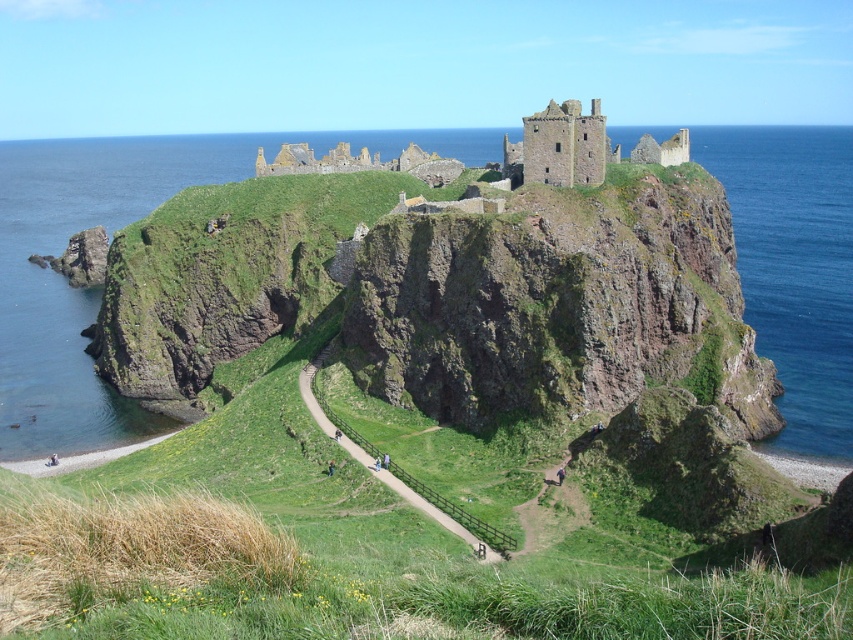
From the picture: Can you confirm if brown stone castle at upper center is taller than green grassy path at center?

Correct, brown stone castle at upper center is much taller as green grassy path at center.

Looking at this image, is brown stone castle at upper center closer to camera compared to green grassy path at center?

No, brown stone castle at upper center is behind green grassy path at center.

Locate an element on the screen. The height and width of the screenshot is (640, 853). brown stone castle at upper center is located at coordinates (561, 147).

Identify the location of brown stone castle at upper center. (561, 147).

Can you confirm if blue water at upper left is smaller than green grassy path at center?

Incorrect, blue water at upper left is not smaller in size than green grassy path at center.

Is point (61, 211) positioned behind point (363, 438)?

Yes.

Find the location of a particular element. blue water at upper left is located at coordinates (109, 236).

Measure the distance between point [135,141] and camera.

They are 508.88 meters apart.

Which is below, blue water at upper left or brown stone castle at upper center?

brown stone castle at upper center

Describe the element at coordinates (109, 236) in the screenshot. I see `blue water at upper left` at that location.

Image resolution: width=853 pixels, height=640 pixels. Identify the location of blue water at upper left. (109, 236).